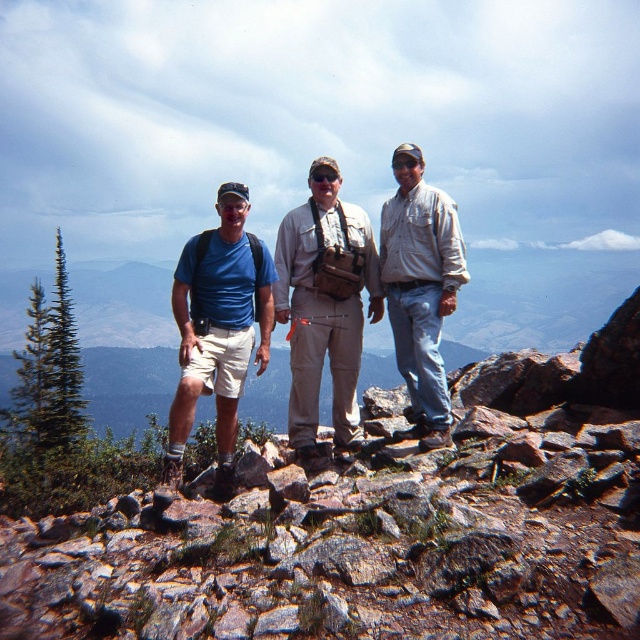
Question: Estimate the real-world distances between objects in this image. Which object is farther from the khaki cotton pants at center?

Choices:
 (A) light brown shirt at center
 (B) matte blue shirt at center

Answer: (A)

Question: Which object is positioned closest to the matte blue shirt at center?

Choices:
 (A) matte blue t-shirt at center
 (B) light brown shirt at center
 (C) khaki cotton pants at center

Answer: (A)

Question: Does matte blue t-shirt at center lie behind khaki cotton pants at center?

Choices:
 (A) yes
 (B) no

Answer: (B)

Question: Does matte blue t-shirt at center have a smaller size compared to light brown shirt at center?

Choices:
 (A) yes
 (B) no

Answer: (A)

Question: Can you confirm if khaki cotton pants at center is positioned to the left of light brown shirt at center?

Choices:
 (A) no
 (B) yes

Answer: (B)

Question: Which point is closer to the camera taking this photo?

Choices:
 (A) (401, 202)
 (B) (224, 264)
 (C) (321, 324)
 (D) (184, 264)

Answer: (D)